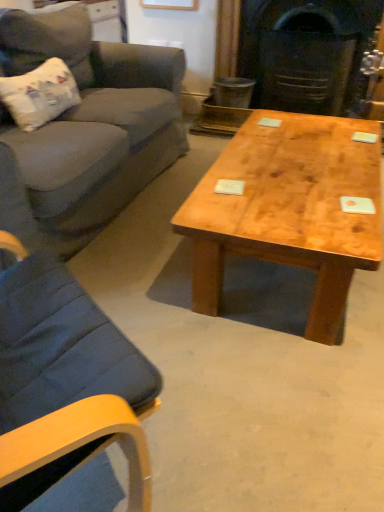
Find the location of `vacant space in front of natural wood coffee table at center`. vacant space in front of natural wood coffee table at center is located at coordinates (276, 384).